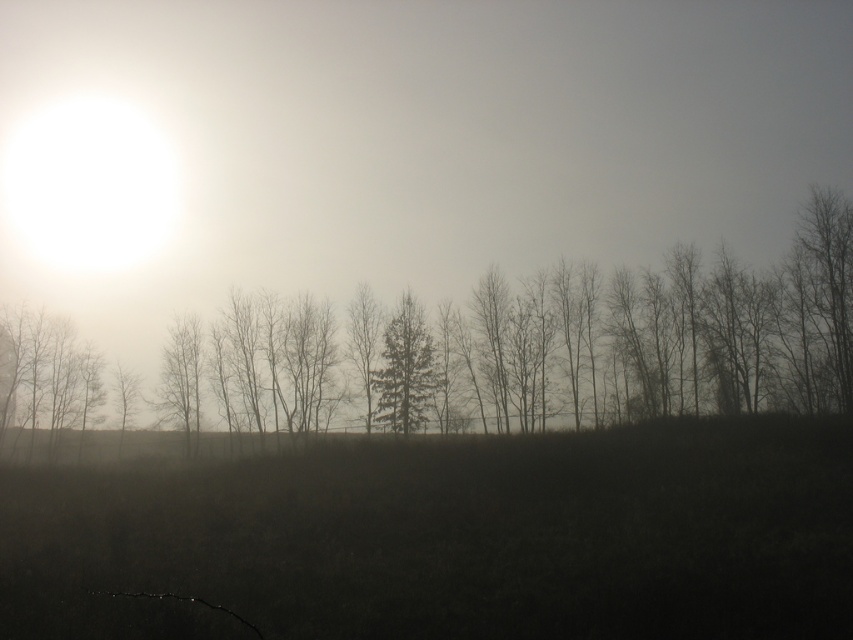
Is dark grass at center bigger than green matte tree at center?

Correct, dark grass at center is larger in size than green matte tree at center.

Is dark grass at center to the right of green matte tree at center from the viewer's perspective?

Incorrect, dark grass at center is not on the right side of green matte tree at center.

Where is `dark grass at center`? The width and height of the screenshot is (853, 640). dark grass at center is located at coordinates [x=451, y=538].

Looking at this image, can you confirm if silhouette bare tree at center is shorter than green matte tree at center?

In fact, silhouette bare tree at center may be taller than green matte tree at center.

Is silhouette bare tree at center below green matte tree at center?

No.

Describe the element at coordinates (656, 339) in the screenshot. The height and width of the screenshot is (640, 853). I see `silhouette bare tree at center` at that location.

Locate an element on the screen. The image size is (853, 640). silhouette bare tree at center is located at coordinates (656, 339).

Consider the image. Is dark grass at center above silhouette bare tree at center?

Actually, dark grass at center is below silhouette bare tree at center.

Who is higher up, dark grass at center or silhouette bare tree at center?

Positioned higher is silhouette bare tree at center.

Locate an element on the screen. The height and width of the screenshot is (640, 853). dark grass at center is located at coordinates (451, 538).